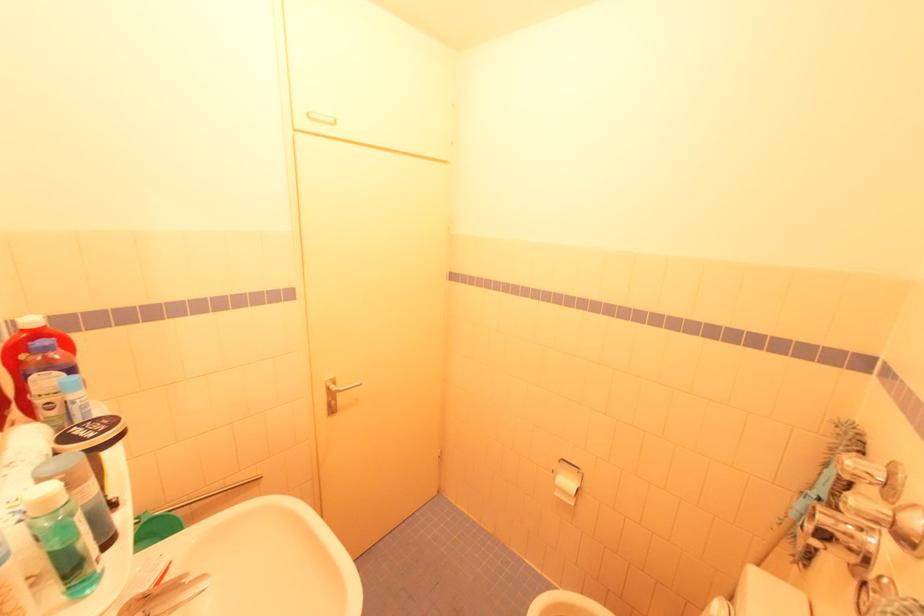
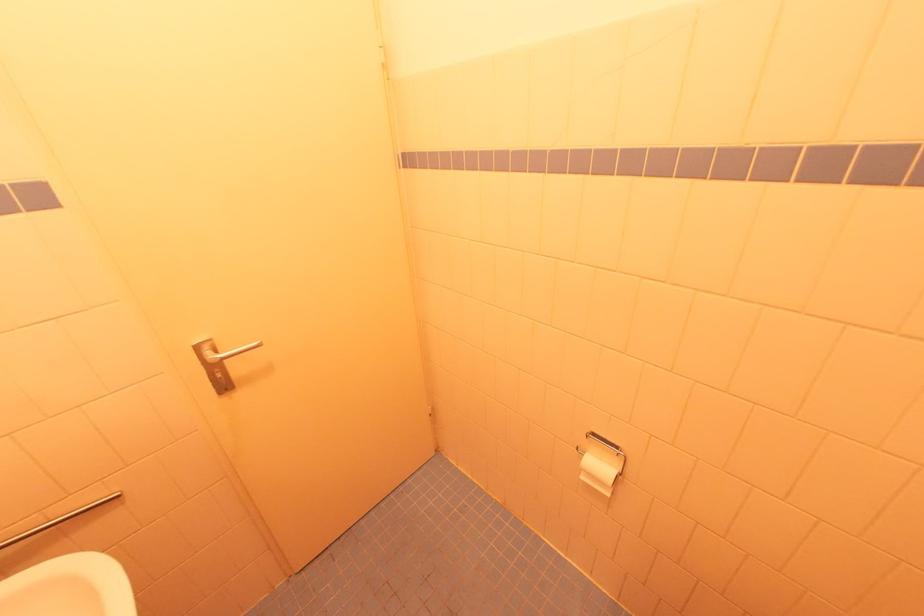
Find the pixel in the second image that matches (329,381) in the first image.

(197, 345)